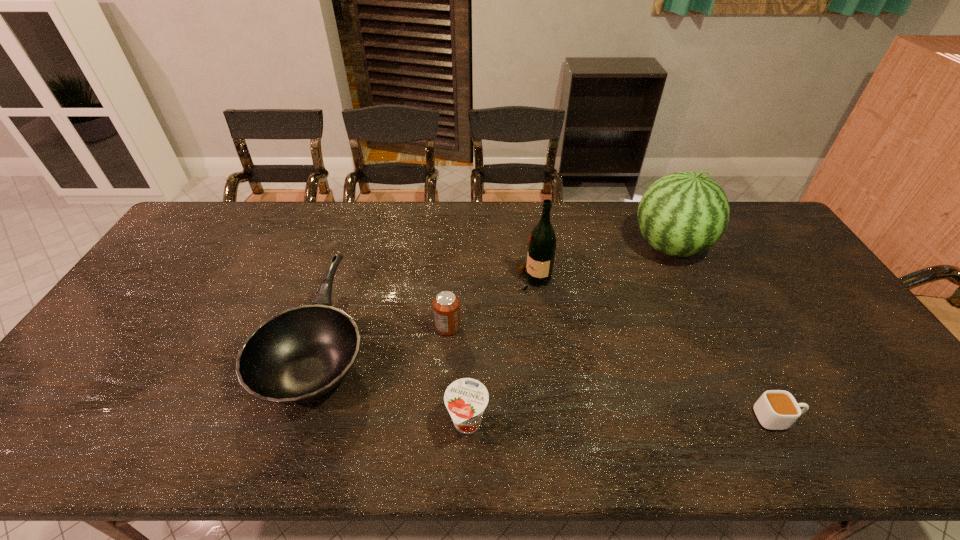
The width and height of the screenshot is (960, 540). In order to click on watermelon in this screenshot , I will do `click(681, 214)`.

Image resolution: width=960 pixels, height=540 pixels. What are the coordinates of `wine bottle` in the screenshot? It's located at (542, 243).

Where is `can`? Image resolution: width=960 pixels, height=540 pixels. can is located at coordinates (446, 305).

I want to click on the leftmost object, so click(298, 355).

I want to click on yogurt, so click(x=465, y=399).

The image size is (960, 540). In order to click on cup in this screenshot , I will do `click(776, 409)`.

The image size is (960, 540). Identify the location of vacant area located 0.110m on the back of the watermelon. (650, 205).

The width and height of the screenshot is (960, 540). What are the coordinates of `free space located on the surface of the fourth object from left to right` in the screenshot? It's located at (469, 280).

Image resolution: width=960 pixels, height=540 pixels. I want to click on vacant space positioned on the surface of the fourth object from left to right, so click(476, 280).

Where is `free space located on the surface of the fourth object from left to right`? free space located on the surface of the fourth object from left to right is located at coordinates (420, 280).